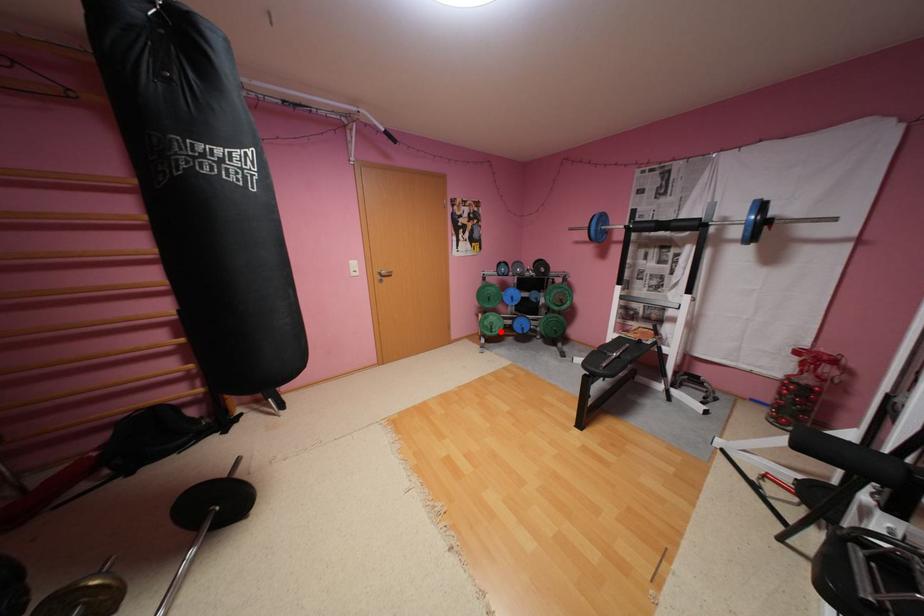
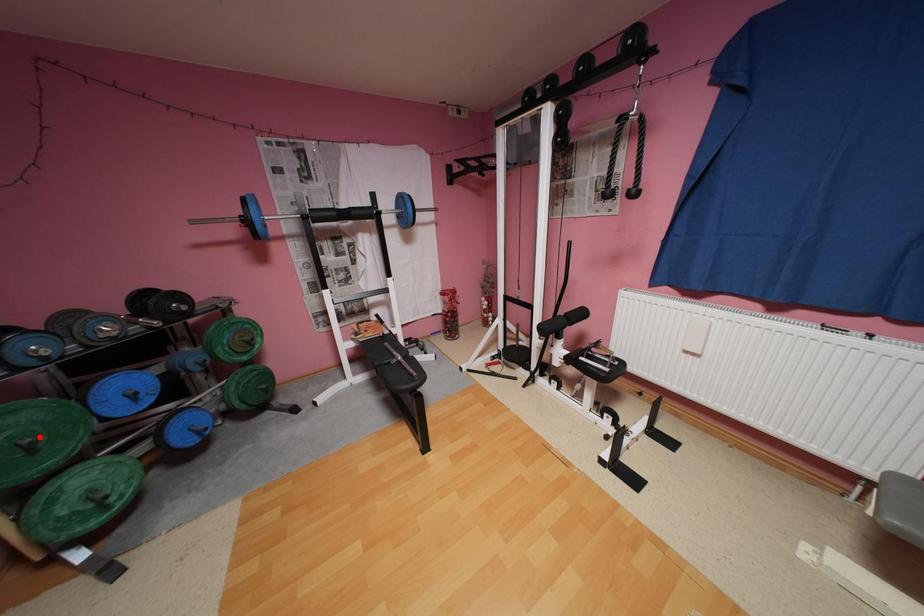
I am providing you with two images of the same scene from different viewpoints. A red point is marked on the first image and another point is marked on the second image. Is the red point in image1 aligned with the point shown in image2?

No